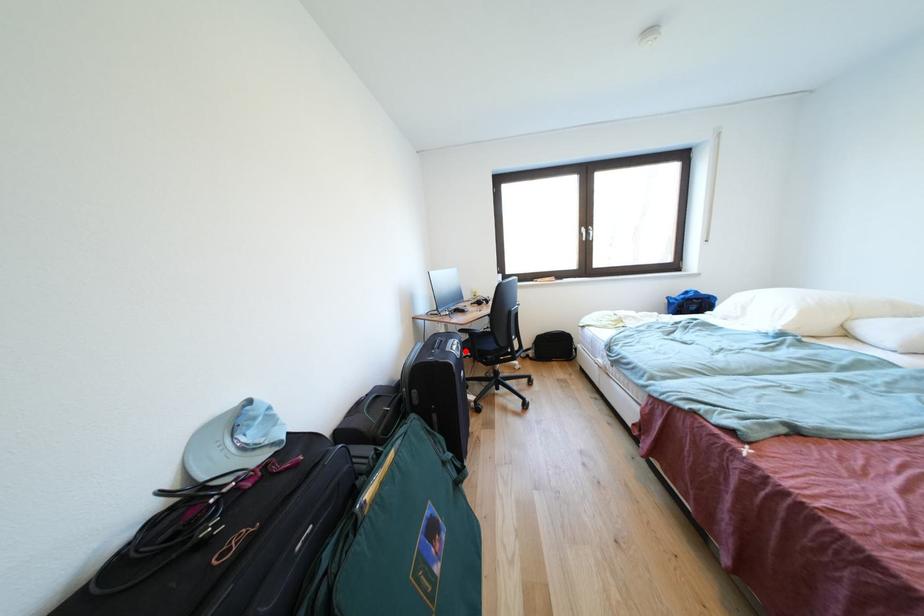
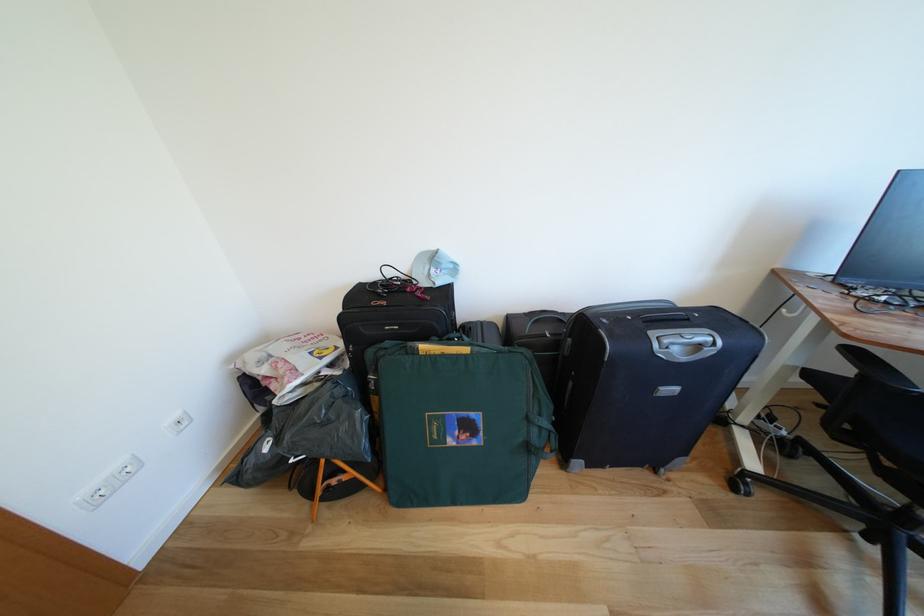
Find the pixel in the second image that matches the highlighted location in the first image.

(707, 351)